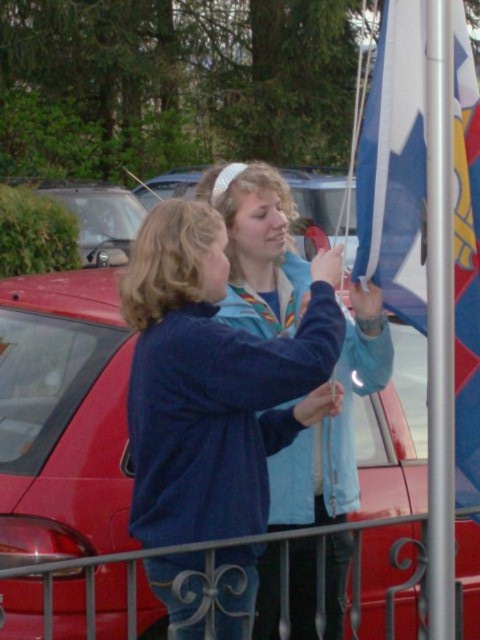
Question: Which point is farther from the camera taking this photo?

Choices:
 (A) (x=475, y=618)
 (B) (x=408, y=288)
 (C) (x=275, y=304)

Answer: (A)

Question: Does metallic red car at center have a smaller size compared to blue fleece jacket at center?

Choices:
 (A) no
 (B) yes

Answer: (A)

Question: Among these points, which one is nearest to the camera?

Choices:
 (A) (392, 145)
 (B) (80, 547)
 (C) (323, 420)

Answer: (A)

Question: Among these points, which one is nearest to the camera?

Choices:
 (A) (68, 369)
 (B) (471, 268)

Answer: (B)

Question: Can you confirm if metallic red car at center is positioned to the left of blue fleece jacket at center?

Choices:
 (A) no
 (B) yes

Answer: (B)

Question: Does metallic red car at center appear under blue fleece jacket at center?

Choices:
 (A) yes
 (B) no

Answer: (B)